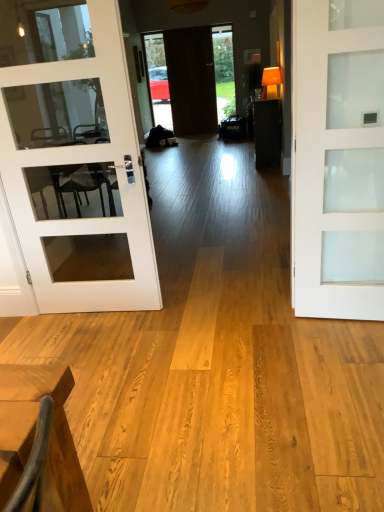
Question: Is dark wood table at center far away from white frosted glass door at center, positioned as the first door in front-to-back order?

Choices:
 (A) yes
 (B) no

Answer: (A)

Question: Does dark wood table at center have a lesser height compared to white frosted glass door at center, placed as the third door when sorted from top to bottom?

Choices:
 (A) no
 (B) yes

Answer: (B)

Question: Is dark wood table at center facing towards white frosted glass door at center, placed as the third door when sorted from top to bottom?

Choices:
 (A) no
 (B) yes

Answer: (A)

Question: Is dark wood table at center facing away from white frosted glass door at center, placed as the third door when sorted from top to bottom?

Choices:
 (A) no
 (B) yes

Answer: (A)

Question: Can you confirm if dark wood table at center is bigger than white frosted glass door at center, the third door positioned from the left?

Choices:
 (A) yes
 (B) no

Answer: (A)

Question: Is dark wood table at center at the right side of white frosted glass door at center, placed as the third door when sorted from top to bottom?

Choices:
 (A) yes
 (B) no

Answer: (A)

Question: Is white glass door at left, which ranks as the second door in bottom-to-top order, at the back of dark wood door at center, positioned as the second door in left-to-right order?

Choices:
 (A) yes
 (B) no

Answer: (B)

Question: From a real-world perspective, is dark wood door at center, the second door when ordered from right to left, positioned over white glass door at left, marked as the 3th door in a right-to-left arrangement, based on gravity?

Choices:
 (A) yes
 (B) no

Answer: (A)

Question: Is the surface of dark wood door at center, marked as the 1th door in a top-to-bottom arrangement, in direct contact with white glass door at left, marked as the 3th door in a right-to-left arrangement?

Choices:
 (A) no
 (B) yes

Answer: (A)

Question: Can you confirm if dark wood door at center, arranged as the third door when viewed from the front, is wider than white glass door at left, which ranks as the second door in bottom-to-top order?

Choices:
 (A) no
 (B) yes

Answer: (A)

Question: Can we say dark wood door at center, arranged as the third door when viewed from the front, lies outside white glass door at left, acting as the 2th door starting from the back?

Choices:
 (A) yes
 (B) no

Answer: (A)

Question: Can you confirm if dark wood door at center, arranged as the third door when viewed from the front, is taller than white glass door at left, which ranks as the second door in bottom-to-top order?

Choices:
 (A) no
 (B) yes

Answer: (B)

Question: Is dark wood table at center smaller than white glass door at left, marked as the 3th door in a right-to-left arrangement?

Choices:
 (A) no
 (B) yes

Answer: (A)